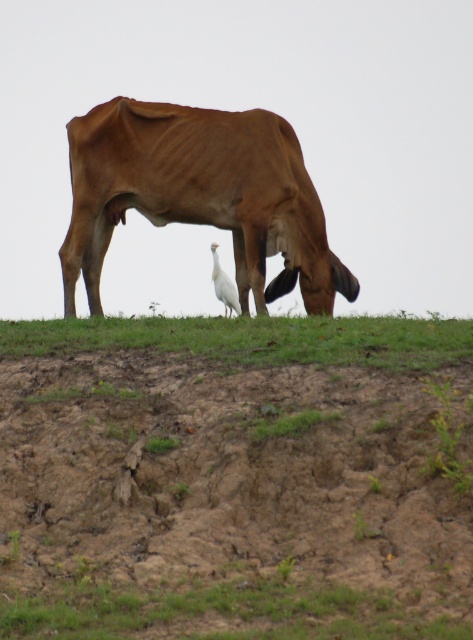
From the picture: You are a farmer checking the space between two fences. The distance between the fences is exactly the width of the brown glossy cow at center. Can the white smooth bird at center fly through this space without touching the fences?

The brown glossy cow at center might be wider than the white smooth bird at center. Since the distance between the fences matches the cow s width, the bird should be able to fly through as it is likely narrower than the cow.

You are standing at the top of the hill and see the brown glossy cow at center and the green grass at lower center. Which object is positioned to the left of the other?

The brown glossy cow at center is to the left of green grass at lower center.

You are standing at the point marked by the coordinate point at (200, 195). What object are you standing on?

The point at (200, 195) is on the brown glossy cow at center.